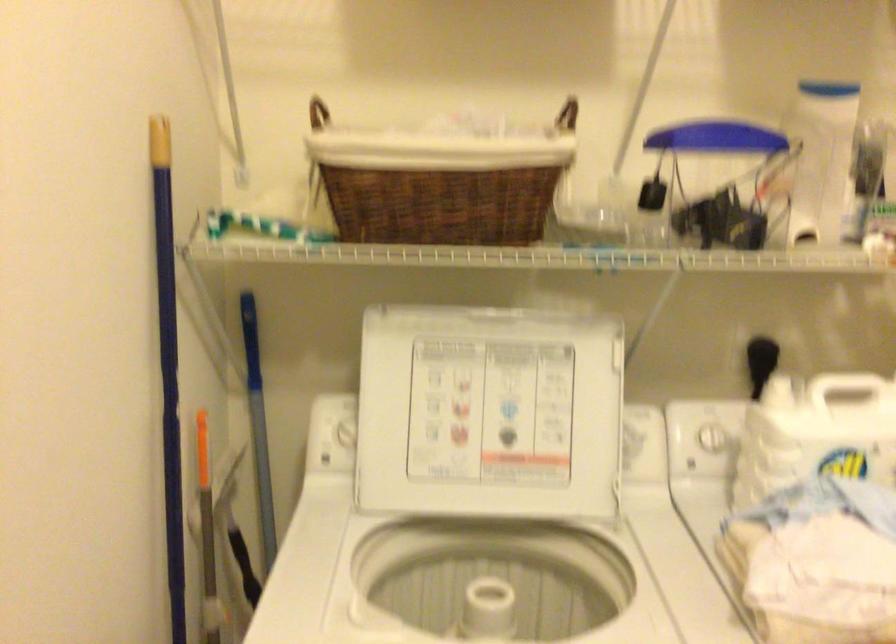
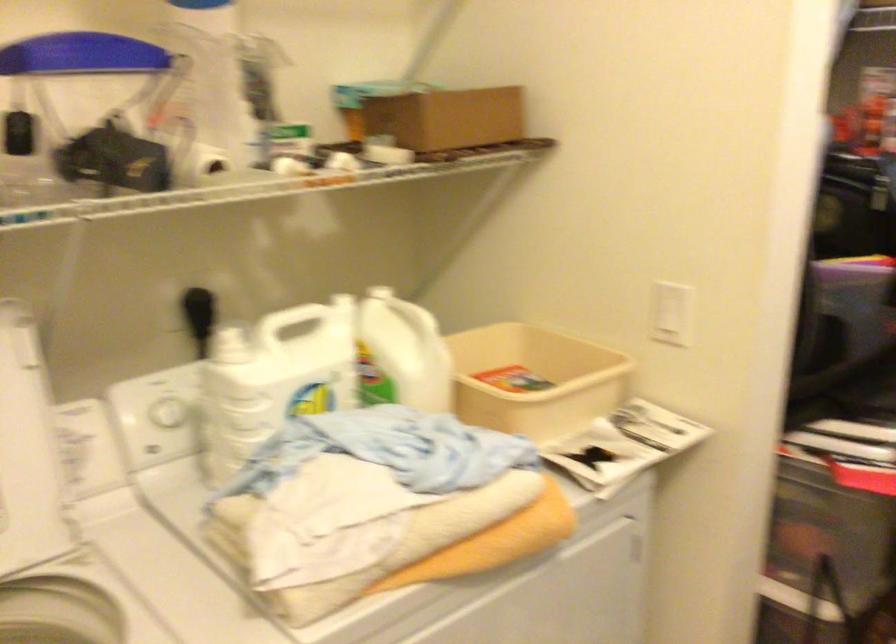
Where in the second image is the point corresponding to (x=806, y=232) from the first image?

(211, 162)